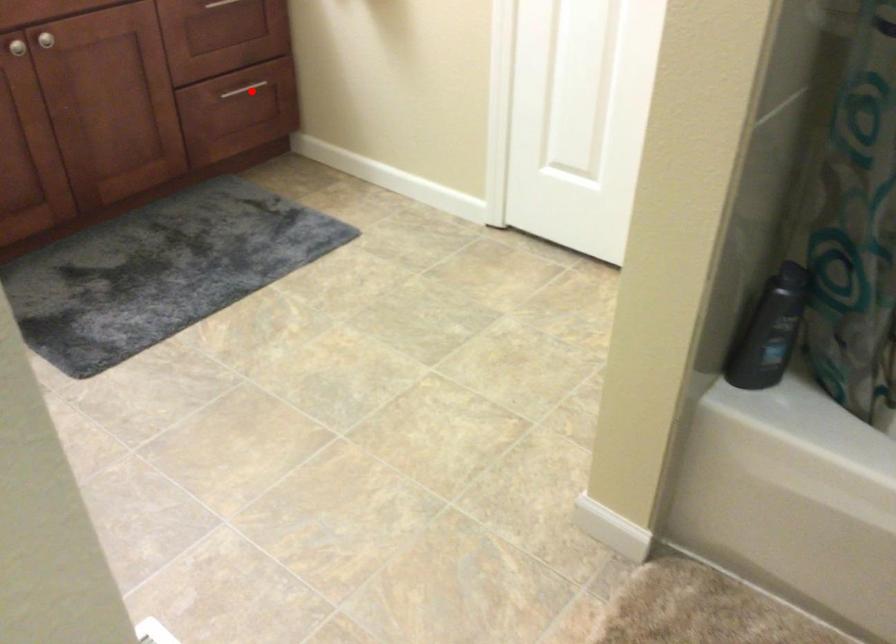
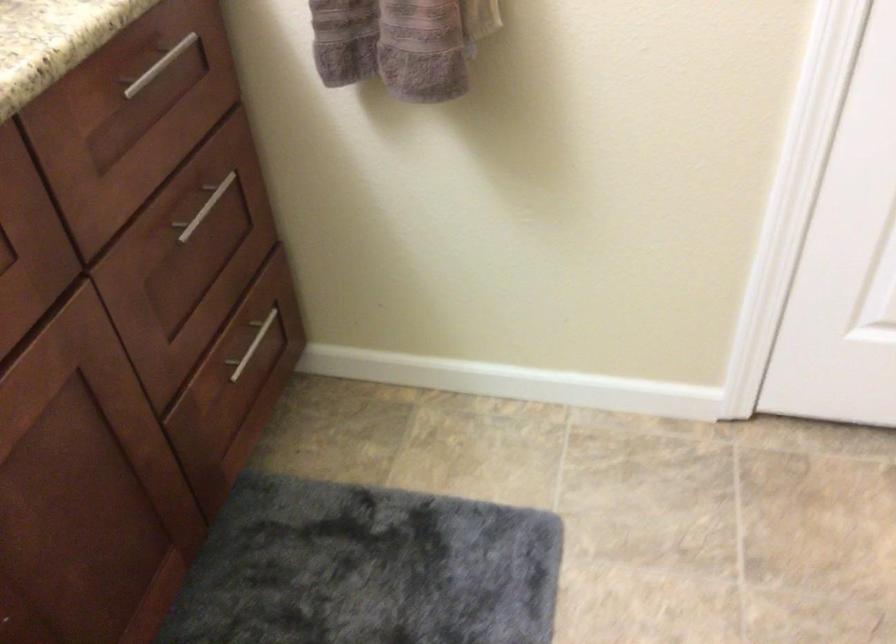
Where in the second image is the point corresponding to the highlighted location from the first image?

(252, 345)